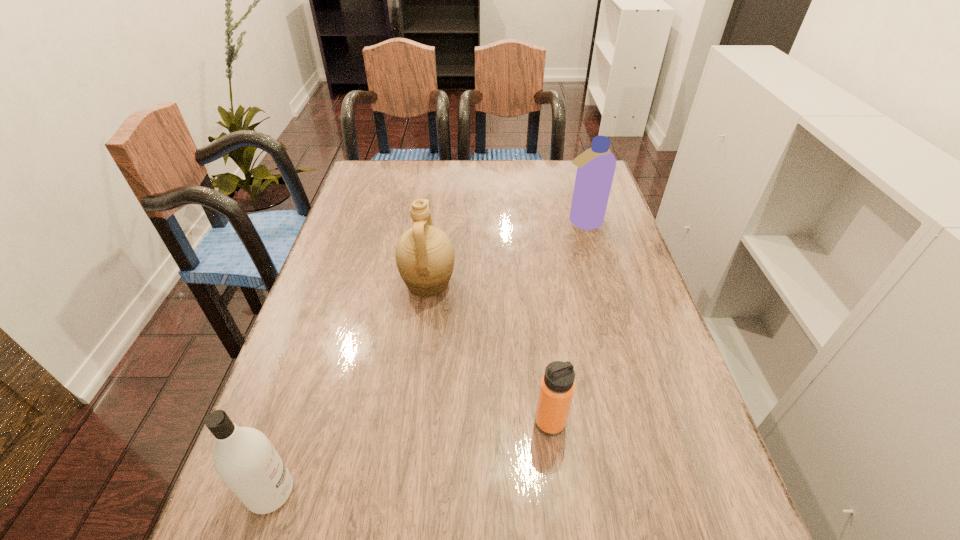
You are a GUI agent. You are given a task and a screenshot of the screen. Output one action in this format:
    pyautogui.click(x=<x>, y=<y>)
    Task: Click on the blank space located on the front-facing side of the nearest object
    
    Given the screenshot: What is the action you would take?
    pyautogui.click(x=391, y=492)

Locate an element on the screen. The image size is (960, 540). vacant region located 0.260m on the left of the shortest object is located at coordinates (404, 422).

This screenshot has width=960, height=540. In order to click on object situated at the left edge in this screenshot , I will do `click(244, 458)`.

Find the location of a particular element. The width and height of the screenshot is (960, 540). object that is at the right edge is located at coordinates (596, 166).

Locate an element on the screen. vacant space at the far edge of the desktop is located at coordinates (542, 172).

At what (x,y) coordinates should I click in order to perform the action: click on free space at the left edge of the desktop. Please return your answer as a coordinate pair (x, y). The image size is (960, 540). Looking at the image, I should click on (249, 523).

Where is `free space at the right edge of the desktop`? The width and height of the screenshot is (960, 540). free space at the right edge of the desktop is located at coordinates (648, 352).

This screenshot has height=540, width=960. Find the location of `free region at the far left corner`. free region at the far left corner is located at coordinates (386, 162).

Locate an element on the screen. free spot between the leftmost object and the farthest object is located at coordinates (426, 357).

Locate an element on the screen. vacant point located between the left shampoo and the second object from right to left is located at coordinates (411, 457).